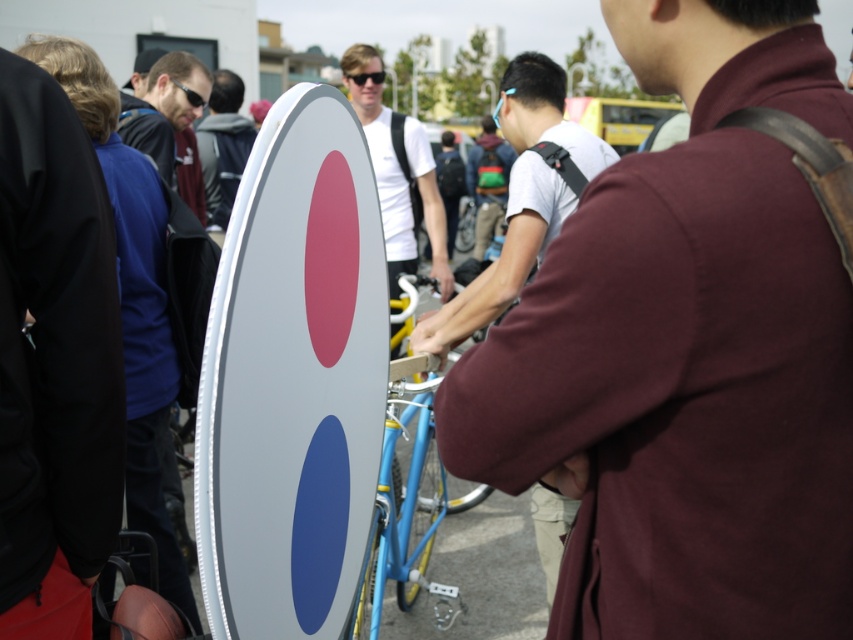
You are organizing a photo shoot at this event and need to position a camera between the white matte shirt at center and the dark gray backpack at center. Based on their widths, which object should be closer to the camera to ensure both fit in the frame?

The white matte shirt at center might be wider than the dark gray backpack at center, so positioning the white matte shirt at center closer to the camera would help accommodate its wider size while keeping the dark gray backpack at center slightly farther back, ensuring both fit within the frame.